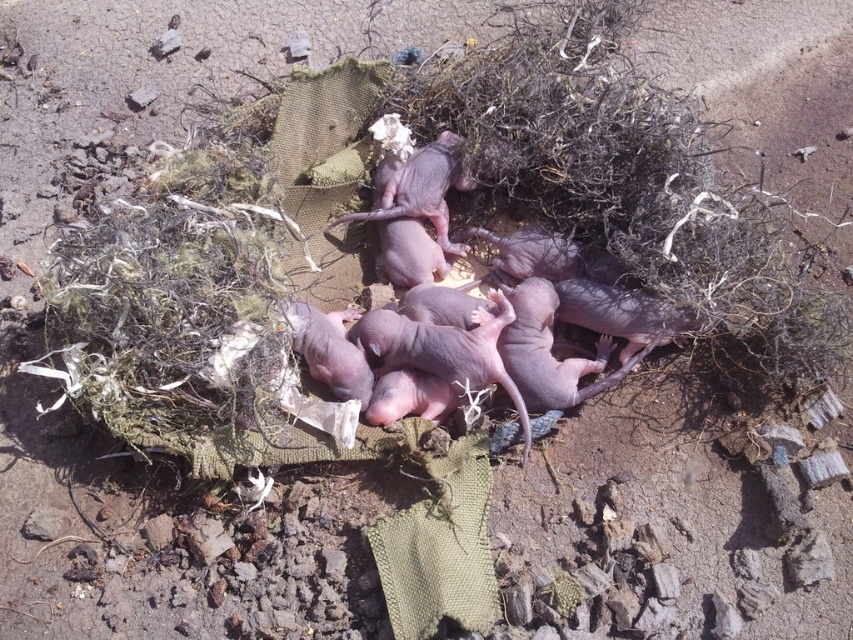
You are a wildlife photographer observing the pink furless mice at center and the pink smooth mouse at center in their nest. Which mouse is located to the right of the other?

The pink furless mice at center is positioned on the right side of pink smooth mouse at center.

You are a wildlife photographer aiming to capture a closeup of the pink furless mice at center without disturbing them. Considering the distance between you and the mice, what is the minimum focal length lens you should use if you want the mice to fill 50 percent of the frame?

The minimum focal length lens required would depend on the sensor size of your camera, but given the distance of 2.47 meters, a lens with a focal length of at least 300mm on a full frame camera would be necessary to achieve a closeup where the pink furless mice at center fill 50 percent of the frame.